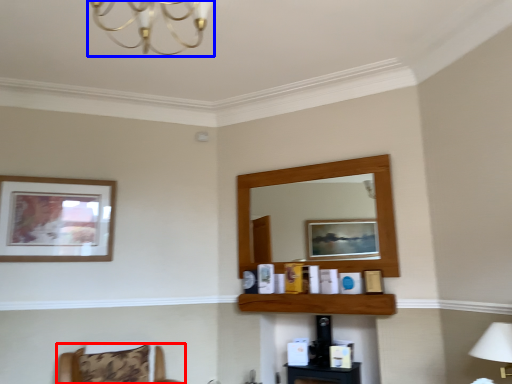
Question: Which object is further to the camera taking this photo, furniture (highlighted by a red box) or light fixture (highlighted by a blue box)?

Choices:
 (A) furniture
 (B) light fixture

Answer: (A)